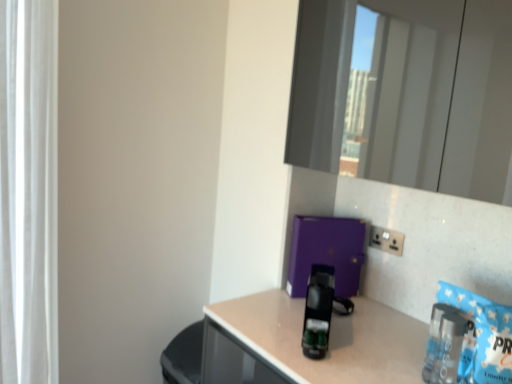
Question: From their relative heights in the image, would you say black plastic coffee machine at center is taller or shorter than white plastic electric outlet at upper right?

Choices:
 (A) tall
 (B) short

Answer: (A)

Question: In the image, is black plastic coffee machine at center on the left side or the right side of white plastic electric outlet at upper right?

Choices:
 (A) left
 (B) right

Answer: (A)

Question: Based on their relative distances, which object is farther from the white sheer curtain at left?

Choices:
 (A) clear plastic bottle at lower right
 (B) white plastic electric outlet at upper right
 (C) black plastic coffee machine at center

Answer: (A)

Question: Which object is the closest to the white plastic electric outlet at upper right?

Choices:
 (A) clear plastic bottle at lower right
 (B) white sheer curtain at left
 (C) black plastic coffee machine at center

Answer: (C)